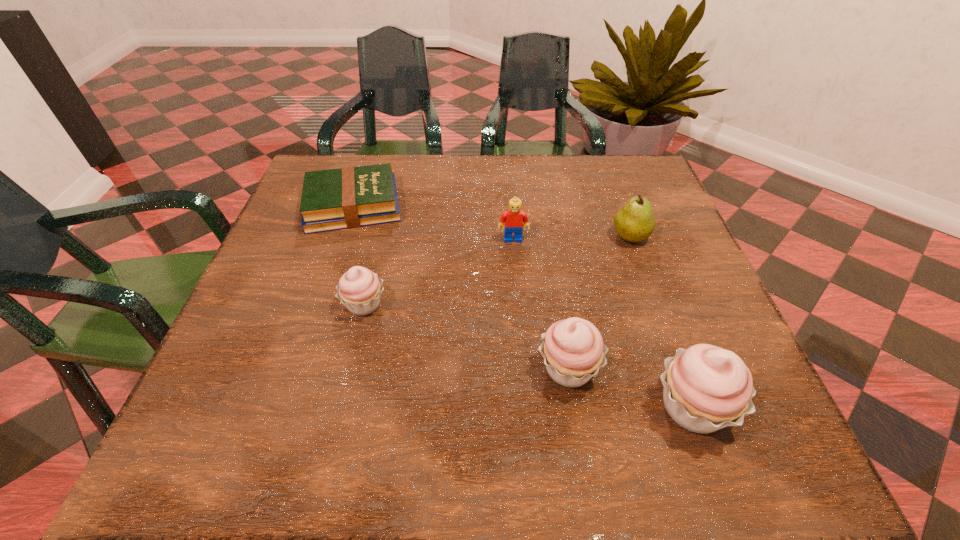
Identify the location of free area in between the rightmost cupcake and the pear. (661, 322).

The image size is (960, 540). In order to click on vacant area that lies between the pear and the rightmost cupcake in this screenshot , I will do `click(661, 322)`.

At what (x,y) coordinates should I click in order to perform the action: click on empty location between the pear and the shortest object. Please return your answer as a coordinate pair (x, y). Looking at the image, I should click on (492, 221).

Locate an element on the screen. The image size is (960, 540). free space between the farthest cupcake and the shortest object is located at coordinates (359, 255).

Where is `empty space that is in between the pear and the Lego`? This screenshot has width=960, height=540. empty space that is in between the pear and the Lego is located at coordinates (571, 238).

Locate an element on the screen. The height and width of the screenshot is (540, 960). free space between the pear and the farthest cupcake is located at coordinates (497, 271).

Locate which object is the second closest to the pear. Please provide its 2D coordinates. Your answer should be formatted as a tuple, i.e. [(x, y)], where the tuple contains the x and y coordinates of a point satisfying the conditions above.

[(573, 350)]

You are a GUI agent. You are given a task and a screenshot of the screen. Output one action in this format:
    pyautogui.click(x=<x>, y=<y>)
    Task: Click on the object that is the second closest to the second cupcake from right to left
    Image resolution: width=960 pixels, height=540 pixels.
    Given the screenshot: What is the action you would take?
    pyautogui.click(x=634, y=222)

At what (x,y) coordinates should I click in order to perform the action: click on cupcake object that ranks as the closest to the shortest object. Please return your answer as a coordinate pair (x, y). This screenshot has height=540, width=960. Looking at the image, I should click on (359, 289).

The width and height of the screenshot is (960, 540). In order to click on cupcake object that ranks as the second closest to the leftmost cupcake in this screenshot , I will do `click(706, 388)`.